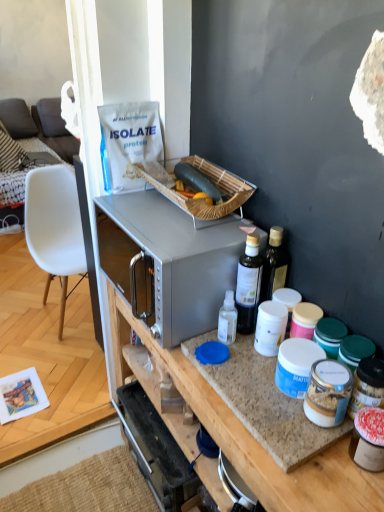
Identify the location of translucent plastic bottle at center-right, which is counted as the 1th bottle, starting from the right. (249, 284).

Measure the distance between transparent plastic bottle at center, arranged as the 2th bottle when viewed from the right, and camera.

They are 3.56 feet apart.

Locate an element on the screen. transparent plastic bottle at center, arranged as the 2th bottle when viewed from the right is located at coordinates (227, 319).

Measure the distance between satin silver microwave at center and camera.

98.47 centimeters.

Identify the location of granite countertop at center. (264, 402).

I want to click on chair below the bamboo picnic basket at upper center (from the image's perspective), so click(x=54, y=227).

Looking at their sizes, would you say white plastic chair at left is wider or thinner than bamboo picnic basket at upper center?

white plastic chair at left is wider than bamboo picnic basket at upper center.

Who is more distant, granite countertop at center or transparent plastic bottle at center, which is counted as the first bottle, starting from the left?

Positioned behind is transparent plastic bottle at center, which is counted as the first bottle, starting from the left.

Based on the photo, from the image's perspective, would you say granite countertop at center is positioned over transparent plastic bottle at center, which is counted as the first bottle, starting from the left?

Actually, granite countertop at center appears below transparent plastic bottle at center, which is counted as the first bottle, starting from the left, in the image.

Locate an element on the screen. The width and height of the screenshot is (384, 512). the 2nd bottle behind the granite countertop at center is located at coordinates (227, 319).

Does granite countertop at center appear on the left side of transparent plastic bottle at center, arranged as the 2th bottle when viewed from the right?

No, granite countertop at center is not to the left of transparent plastic bottle at center, arranged as the 2th bottle when viewed from the right.

Is granite countertop at center positioned far away from granite countertop at center?

granite countertop at center is near granite countertop at center, not far away.

Is granite countertop at center a part of granite countertop at center?

Actually, granite countertop at center is outside granite countertop at center.

From the image's perspective, which is above, granite countertop at center or granite countertop at center?

granite countertop at center, from the image's perspective.

Is granite countertop at center oriented towards granite countertop at center?

No.

From a real-world perspective, is satin silver microwave at center above or below granite countertop at center?

satin silver microwave at center is situated higher than granite countertop at center in the real world.

Is point (207, 319) farther from viewer compared to point (265, 473)?

Yes.

You are a GUI agent. You are given a task and a screenshot of the screen. Output one action in this format:
    pyautogui.click(x=<x>, y=<y>)
    Task: Click on the microwave oven behind the granite countertop at center
    
    Given the screenshot: What is the action you would take?
    pyautogui.click(x=180, y=260)

Is bamboo picnic basket at upper center at the left side of satin silver microwave at center?

In fact, bamboo picnic basket at upper center is to the right of satin silver microwave at center.

In the scene shown: Which object is thinner, bamboo picnic basket at upper center or satin silver microwave at center?

bamboo picnic basket at upper center.

This screenshot has height=512, width=384. Find the location of `picnic basket to the right of satin silver microwave at center`. picnic basket to the right of satin silver microwave at center is located at coordinates (199, 200).

From the image's perspective, which is above, bamboo picnic basket at upper center or satin silver microwave at center?

bamboo picnic basket at upper center, from the image's perspective.

Which object is further away from the camera taking this photo, granite countertop at center or white plastic chair at left?

white plastic chair at left is behind.

From the image's perspective, is granite countertop at center positioned above or below white plastic chair at left?

granite countertop at center is below white plastic chair at left.

Consider the image. From a real-world perspective, is granite countertop at center beneath white plastic chair at left?

No, from a real-world perspective, granite countertop at center is not under white plastic chair at left.

Is white plastic chair at left surrounded by granite countertop at center?

Definitely not — white plastic chair at left is not inside granite countertop at center.

Which of these two, granite countertop at center or bamboo picnic basket at upper center, is wider?

granite countertop at center is wider.

Based on their sizes in the image, would you say granite countertop at center is bigger or smaller than bamboo picnic basket at upper center?

Clearly, granite countertop at center is smaller in size than bamboo picnic basket at upper center.

Does point (285, 432) come closer to viewer compared to point (244, 190)?

Yes, it is.

Is granite countertop at center inside the boundaries of bamboo picnic basket at upper center, or outside?

granite countertop at center is outside bamboo picnic basket at upper center.

Where is `chair that is on the left side of bamboo picnic basket at upper center`? The width and height of the screenshot is (384, 512). chair that is on the left side of bamboo picnic basket at upper center is located at coordinates (54, 227).

Find the location of `desk below the transparent plastic bottle at center, arranged as the 2th bottle when viewed from the right (from the image's perspective)`. desk below the transparent plastic bottle at center, arranged as the 2th bottle when viewed from the right (from the image's perspective) is located at coordinates (254, 438).

Which object lies nearer to the anchor point transparent plastic bottle at center, which is counted as the first bottle, starting from the left, bamboo picnic basket at upper center or satin silver microwave at center?

The object closer to transparent plastic bottle at center, which is counted as the first bottle, starting from the left, is satin silver microwave at center.

From the image, which object appears to be nearer to bamboo picnic basket at upper center, white plastic chair at left or translucent plastic bottle at center-right, which is the 2th bottle in left-to-right order?

The object closer to bamboo picnic basket at upper center is translucent plastic bottle at center-right, which is the 2th bottle in left-to-right order.

From the image, which object appears to be farther from bamboo picnic basket at upper center, green matte zucchini at center or transparent plastic bottle at center, arranged as the 2th bottle when viewed from the right?

Among the two, transparent plastic bottle at center, arranged as the 2th bottle when viewed from the right, is located further to bamboo picnic basket at upper center.

Which object lies further to the anchor point green matte zucchini at center, satin silver microwave at center or translucent plastic bottle at center-right, which is counted as the 1th bottle, starting from the right?

translucent plastic bottle at center-right, which is counted as the 1th bottle, starting from the right, lies further to green matte zucchini at center than the other object.

Which object lies nearer to the anchor point white plastic chair at left, granite countertop at center or granite countertop at center?

granite countertop at center is positioned closer to the anchor white plastic chair at left.

Which object lies nearer to the anchor point transparent plastic bottle at center, which is counted as the first bottle, starting from the left, granite countertop at center or white plastic chair at left?

granite countertop at center lies closer to transparent plastic bottle at center, which is counted as the first bottle, starting from the left, than the other object.

Which object lies nearer to the anchor point green matte zucchini at center, transparent plastic bottle at center, arranged as the 2th bottle when viewed from the right, or white plastic chair at left?

transparent plastic bottle at center, arranged as the 2th bottle when viewed from the right, is positioned closer to the anchor green matte zucchini at center.

Estimate the real-world distances between objects in this image. Which object is further from granite countertop at center, translucent plastic bottle at center-right, which is the 2th bottle in left-to-right order, or satin silver microwave at center?

satin silver microwave at center is further to granite countertop at center.

Image resolution: width=384 pixels, height=512 pixels. Identify the location of table top between satin silver microwave at center and granite countertop at center from top to bottom. (264, 402).

Identify the location of table top between translucent plastic bottle at center-right, which is counted as the 1th bottle, starting from the right, and granite countertop at center vertically. This screenshot has height=512, width=384. (264, 402).

Where is `microwave oven between green matte zucchini at center and granite countertop at center from top to bottom`? The width and height of the screenshot is (384, 512). microwave oven between green matte zucchini at center and granite countertop at center from top to bottom is located at coordinates (180, 260).

Image resolution: width=384 pixels, height=512 pixels. I want to click on bottle between green matte zucchini at center and transparent plastic bottle at center, arranged as the 2th bottle when viewed from the right, vertically, so click(249, 284).